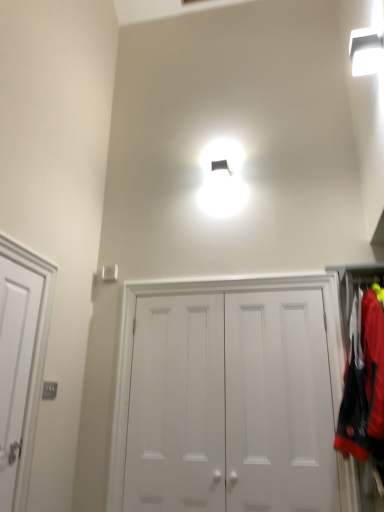
Question: From a real-world perspective, is white matte door at center, which ranks as the 3th door in left-to-right order, over white matte door at center, the 2th door from the left?

Choices:
 (A) yes
 (B) no

Answer: (A)

Question: Can you see white matte door at center, which ranks as the 3th door in left-to-right order, touching white matte door at center, the 2th door from the left?

Choices:
 (A) no
 (B) yes

Answer: (A)

Question: Can you confirm if white matte door at center, which ranks as the 3th door in left-to-right order, is taller than white matte door at center, the 2th door from the left?

Choices:
 (A) yes
 (B) no

Answer: (A)

Question: Could white matte door at center, the 2th door from the left, be considered to be inside white matte door at center, placed as the first door when sorted from right to left?

Choices:
 (A) no
 (B) yes

Answer: (B)

Question: Can you confirm if white matte door at center, placed as the first door when sorted from right to left, is shorter than white matte door at center, the 2th door from the left?

Choices:
 (A) no
 (B) yes

Answer: (A)

Question: Does white matte door at center, which ranks as the 3th door in left-to-right order, have a greater width compared to white matte door at center, the 2th door from the left?

Choices:
 (A) yes
 (B) no

Answer: (B)

Question: From a real-world perspective, is white matte door at center, marked as the 2th door in a right-to-left arrangement, beneath white matte door at left, which is the first door from left to right?

Choices:
 (A) no
 (B) yes

Answer: (B)

Question: Is white matte door at center, the 2th door from the left, positioned behind white matte door at left, positioned as the third door in right-to-left order?

Choices:
 (A) no
 (B) yes

Answer: (B)

Question: Does white matte door at center, marked as the 2th door in a right-to-left arrangement, have a lesser width compared to white matte door at left, positioned as the third door in right-to-left order?

Choices:
 (A) no
 (B) yes

Answer: (B)

Question: Can white matte door at left, which is the first door from left to right, be found inside white matte door at center, the 2th door from the left?

Choices:
 (A) yes
 (B) no

Answer: (B)

Question: Is white matte door at center, marked as the 2th door in a right-to-left arrangement, positioned with its back to white matte door at left, positioned as the third door in right-to-left order?

Choices:
 (A) yes
 (B) no

Answer: (B)

Question: Are white matte door at center, the 2th door from the left, and white matte door at left, positioned as the third door in right-to-left order, far apart?

Choices:
 (A) yes
 (B) no

Answer: (B)

Question: Is red fabric laundry at right located outside white matte door at center, placed as the first door when sorted from right to left?

Choices:
 (A) no
 (B) yes

Answer: (B)